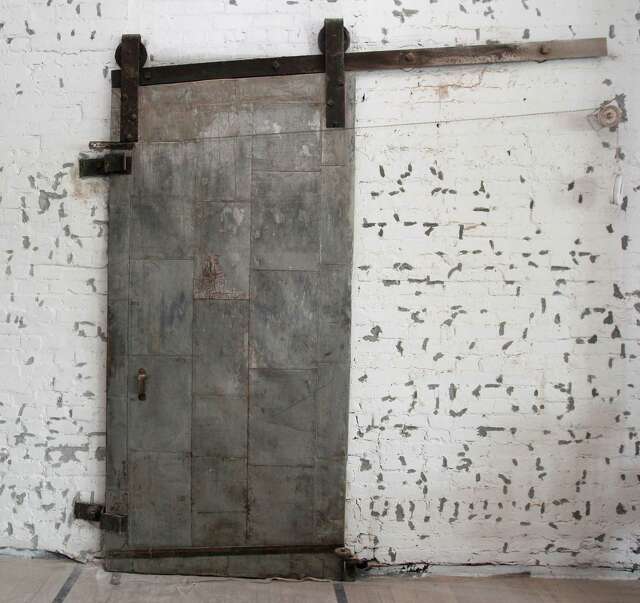
Find the location of `ancient sliding door`. ancient sliding door is located at coordinates coord(237,286).